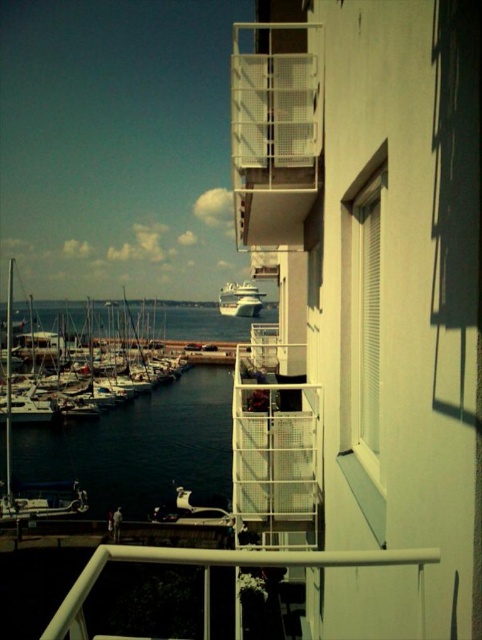
You are standing on the balcony and want to take a photo that includes both the dark blue water at lower left and the white glossy cruise ship at center. Which object should you frame first to ensure both are visible in the photo?

You should frame the dark blue water at lower left first because its width is larger than the white glossy cruise ship at center, so it requires more space in the photo.

You are standing on the balcony and want to take a photo of the white glossy cruise ship at center. However, you notice the dark blue water at lower left might block your view. Based on their sizes, which one is bigger and would likely require adjusting your camera angle?

The dark blue water at lower left is larger in size than the white glossy cruise ship at center, so you need to adjust your camera angle to avoid the larger dark blue water at lower left obstructing the view of the white glossy cruise ship at center.

You are standing on the balcony and want to take a photo of the waterfront. The camera you have can only focus on objects within a 0.5 unit radius from the center point. If you center your camera at the white mesh balcony at upper right, will the entire waterfront scene be within the focus range?

The white mesh balcony at upper right is located at point (276, 131). The camera can focus within a 0.5 unit radius from this point. Since the entire waterfront scene is within the 0.5 unit radius around the center point, the entire scene will be in focus.